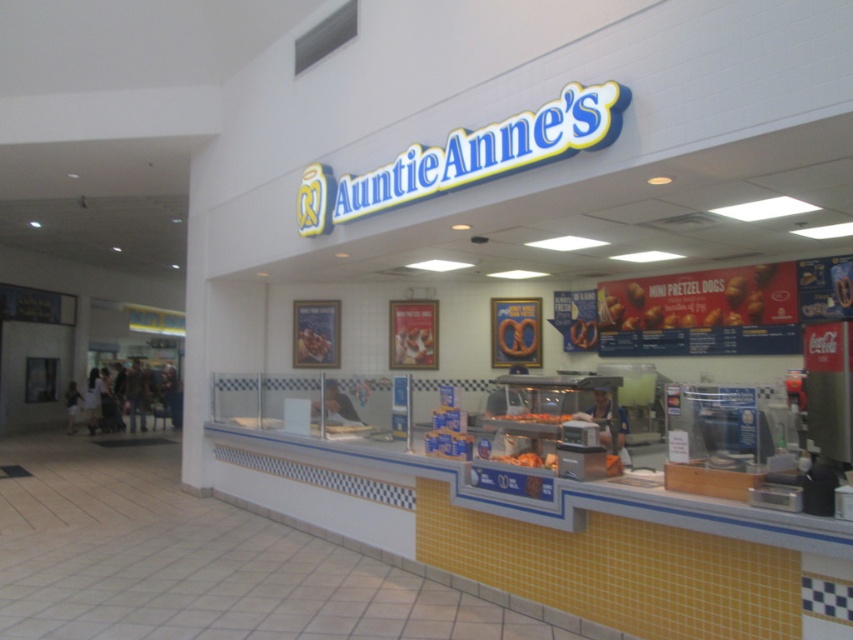
Is point (543, 458) less distant than point (520, 419)?

Yes, point (543, 458) is closer to viewer.

The height and width of the screenshot is (640, 853). In order to click on golden crispy pretzel at center in this screenshot , I will do `click(527, 460)`.

Between point (531, 456) and point (544, 416), which one is positioned behind?

The point (544, 416) is behind.

What are the coordinates of `golden crispy pretzel at center` in the screenshot? It's located at (527, 460).

Which is more to the right, golden crispy pretzel dogs at center or orange crispy pretzel at center?

golden crispy pretzel dogs at center

Does golden crispy pretzel dogs at center have a lesser height compared to orange crispy pretzel at center?

No.

Is point (759, 294) farther from viewer compared to point (548, 420)?

Yes, it is.

This screenshot has width=853, height=640. I want to click on golden crispy pretzel dogs at center, so click(x=700, y=298).

Is golden crispy pretzel dogs at center in front of golden crispy pretzel at center?

No, golden crispy pretzel dogs at center is further to the viewer.

What are the coordinates of `golden crispy pretzel dogs at center` in the screenshot? It's located at (700, 298).

Who is more distant from viewer, [782,291] or [548,458]?

The point [782,291] is more distant.

Where is `golden crispy pretzel dogs at center`? golden crispy pretzel dogs at center is located at coordinates (x=700, y=298).